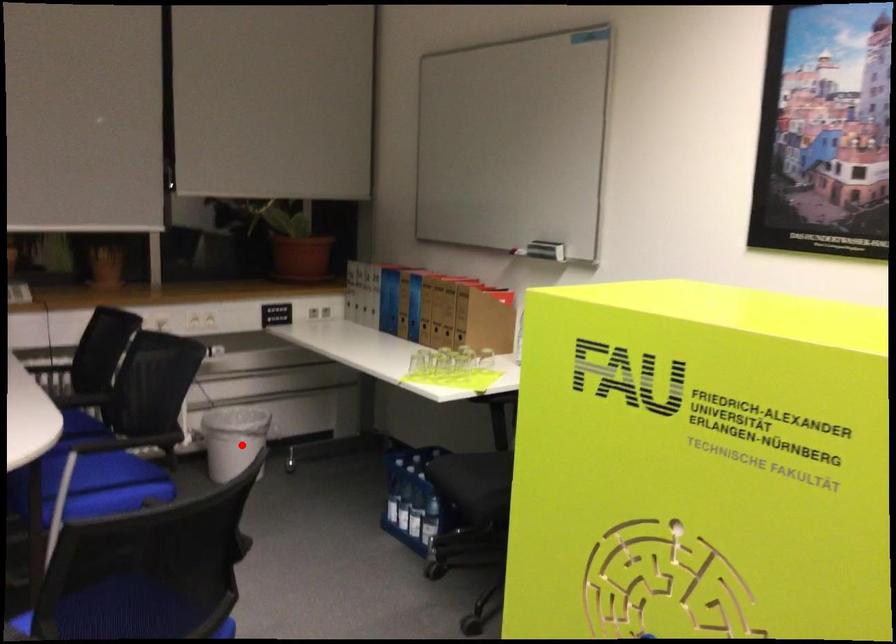
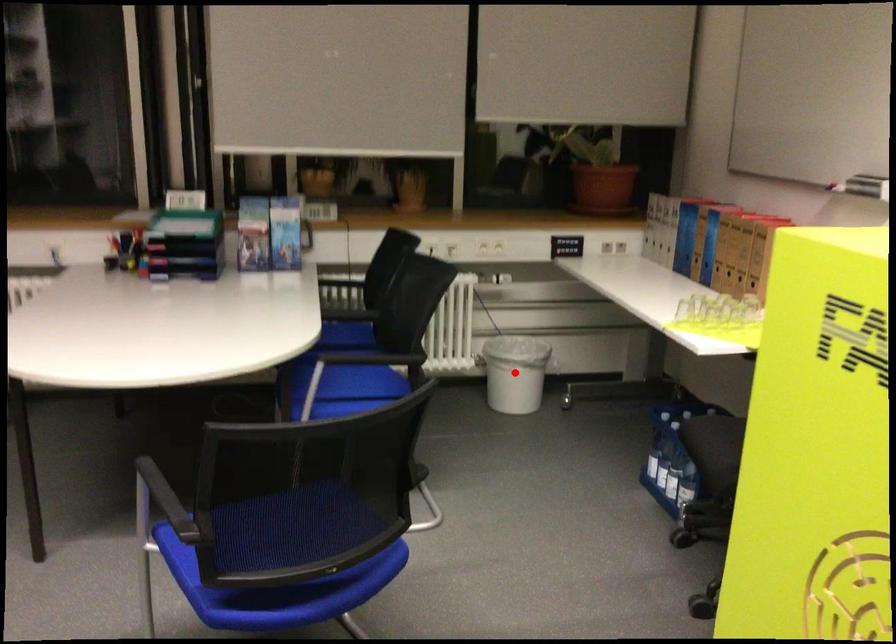
I am providing you with two images of the same scene from different viewpoints. A red point is marked on the first image and another point is marked on the second image. Does the point marked in image1 correspond to the same location as the one in image2?

Yes